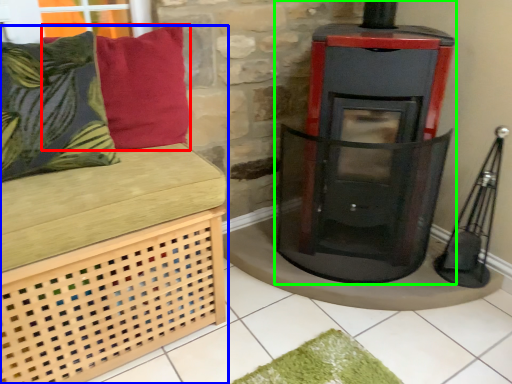
Question: Considering the real-world distances, which object is closest to pillow (highlighted by a red box)? furniture (highlighted by a blue box) or wood burning stove (highlighted by a green box).

Choices:
 (A) furniture
 (B) wood burning stove

Answer: (A)